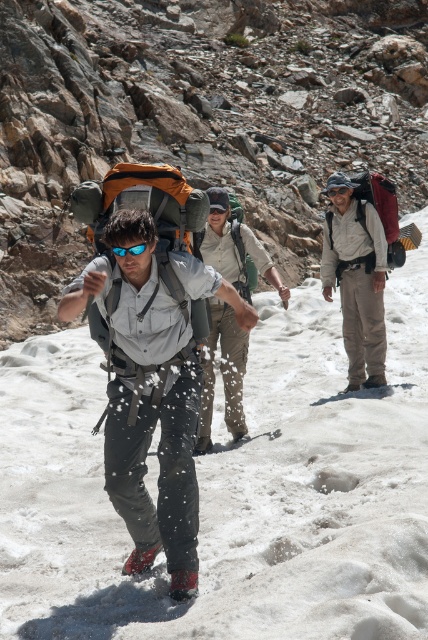
Between point (74, 308) and point (246, 284), which one is positioned in front?

Point (74, 308)

In the scene shown: Can you confirm if matte gray shirt at center is smaller than matte gray backpack at center?

Correct, matte gray shirt at center occupies less space than matte gray backpack at center.

Which is in front, point (232, 294) or point (220, 268)?

Point (232, 294)

Where is `matte gray shirt at center`? This screenshot has height=640, width=428. matte gray shirt at center is located at coordinates (146, 401).

From the picture: Does rough stone hillside at upper left have a greater width compared to matte gray shirt at center?

Yes.

Image resolution: width=428 pixels, height=640 pixels. What do you see at coordinates (199, 116) in the screenshot?
I see `rough stone hillside at upper left` at bounding box center [199, 116].

At what (x,y) coordinates should I click in order to perform the action: click on rough stone hillside at upper left. Please return your answer as a coordinate pair (x, y). This screenshot has width=428, height=640. Looking at the image, I should click on [199, 116].

Does point (154, 552) lie in front of point (152, 246)?

No, it is not.

Which is below, matte gray shirt at center or blue reflective lens at center?

matte gray shirt at center is below.

The image size is (428, 640). What do you see at coordinates (146, 401) in the screenshot?
I see `matte gray shirt at center` at bounding box center [146, 401].

At what (x,y) coordinates should I click in order to perform the action: click on matte gray shirt at center. Please return your answer as a coordinate pair (x, y). This screenshot has width=428, height=640. Looking at the image, I should click on (146, 401).